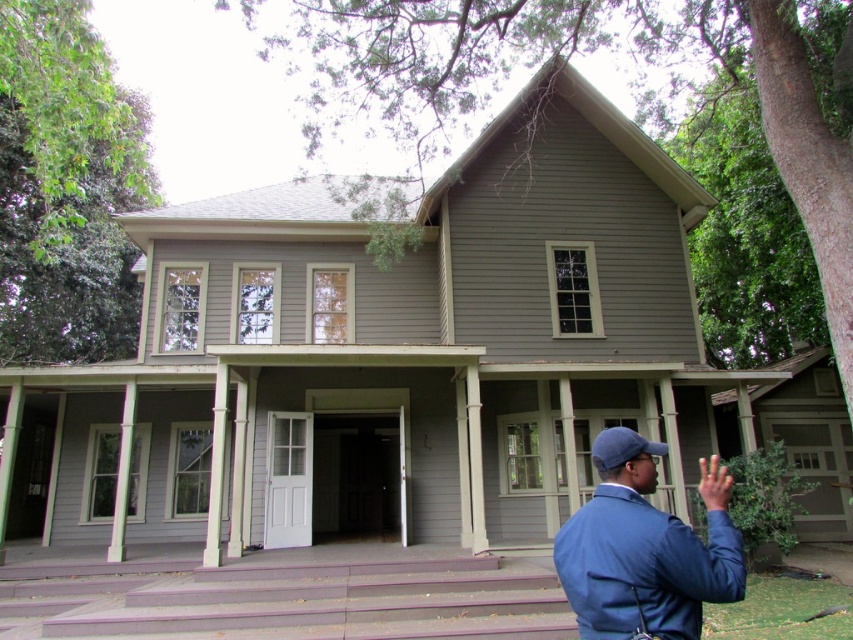
Is blue fabric jacket at lower right shorter than blue fabric baseball cap at center?

No, blue fabric jacket at lower right is not shorter than blue fabric baseball cap at center.

Does blue fabric jacket at lower right appear on the left side of blue fabric baseball cap at center?

Incorrect, blue fabric jacket at lower right is not on the left side of blue fabric baseball cap at center.

Where is `blue fabric jacket at lower right`? blue fabric jacket at lower right is located at coordinates (645, 548).

Does point (514, 547) lie behind point (628, 435)?

Yes, point (514, 547) is behind point (628, 435).

The height and width of the screenshot is (640, 853). Find the location of `smooth gray porch at center`. smooth gray porch at center is located at coordinates (349, 440).

Is smooth gray porch at center to the left of blue fabric jacket at lower right from the viewer's perspective?

Yes, smooth gray porch at center is to the left of blue fabric jacket at lower right.

In the scene shown: Can you confirm if smooth gray porch at center is thinner than blue fabric jacket at lower right?

No.

Between point (68, 518) and point (622, 616), which one is positioned in front?

Point (622, 616) is more forward.

You are a GUI agent. You are given a task and a screenshot of the screen. Output one action in this format:
    pyautogui.click(x=<x>, y=<y>)
    Task: Click on the smooth gray porch at center
    
    Given the screenshot: What is the action you would take?
    (349, 440)